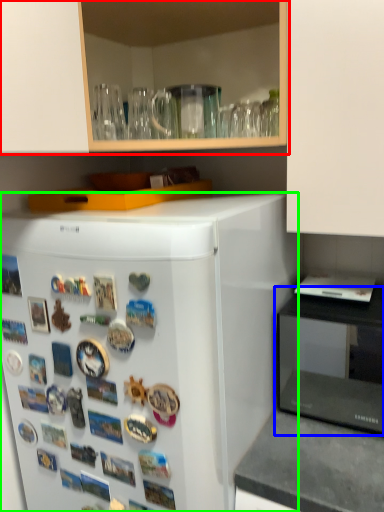
Question: Estimate the real-world distances between objects in this image. Which object is closer to cabinetry (highlighted by a red box), appliance (highlighted by a blue box) or refrigerator (highlighted by a green box)?

Choices:
 (A) appliance
 (B) refrigerator

Answer: (B)